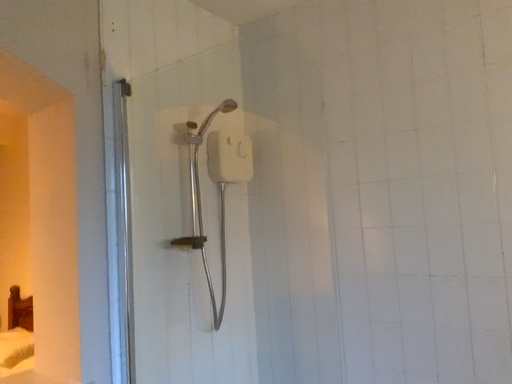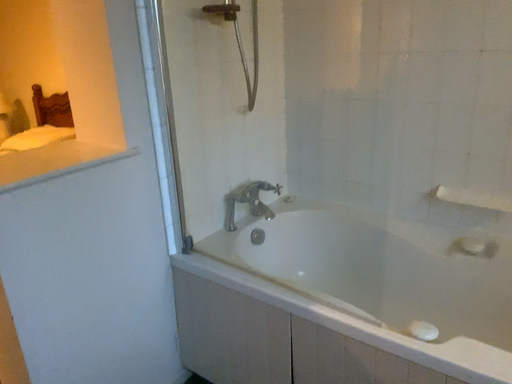
Question: Which way did the camera rotate in the video?

Choices:
 (A) rotated downward
 (B) rotated upward

Answer: (A)